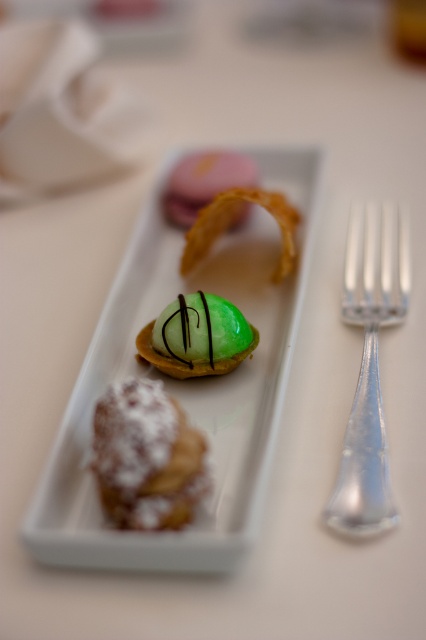
Question: Which point is farther from the camera taking this photo?

Choices:
 (A) (287, 205)
 (B) (83, 532)
 (C) (221, 348)
 (D) (377, 276)

Answer: (A)

Question: Is green glossy dome at center bigger than pink matte macaron at center?

Choices:
 (A) yes
 (B) no

Answer: (A)

Question: Which is nearer to the green glossy tartlet at center?

Choices:
 (A) pink matte macaron at center
 (B) silver metallic fork at right
 (C) golden crispy ring at center
 (D) green glossy dome at center

Answer: (D)

Question: Can you confirm if silver metallic fork at right is bigger than powdered sugar pastry at lower left?

Choices:
 (A) yes
 (B) no

Answer: (A)

Question: Is pink matte macaron at center smaller than golden crispy ring at center?

Choices:
 (A) yes
 (B) no

Answer: (A)

Question: Which point is closer to the camera taking this photo?

Choices:
 (A) (189, 513)
 (B) (218, 166)
 (C) (357, 216)

Answer: (A)